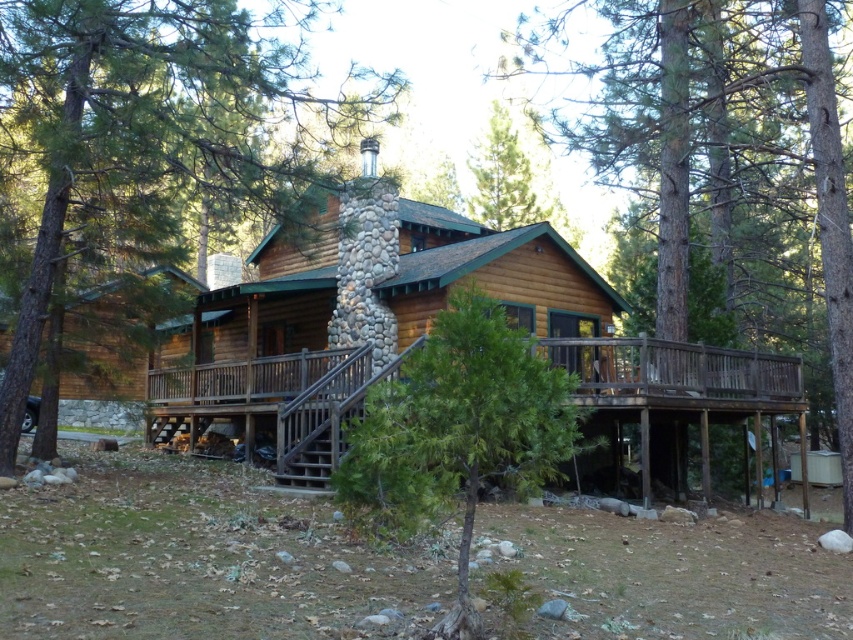
From the picture: You are standing on the wooden deck at lower center and want to see the green textured tree at center. In which direction should you look?

The green textured tree at center is to the left of the wooden deck at lower center, so you should look to your left to see it.

You are standing in front of the rustic log cabin and want to take a photo. There are two points marked in the scene, point 1 at coordinates point (352, 364) and point 2 at coordinates point (788, 371). Which point is closer to you?

Point (352, 364) is closer to the camera than point (788, 371).

You are planning to build a new deck that matches the existing wooden deck at lower center. The wooden cabin at center is currently narrower than the deck. If you want the new deck to be the same width as the cabin, how should you adjust the deck?

The wooden cabin at center is narrower than the wooden deck at lower center. To make the new deck the same width as the cabin, you should reduce the deck width to match the cabin.